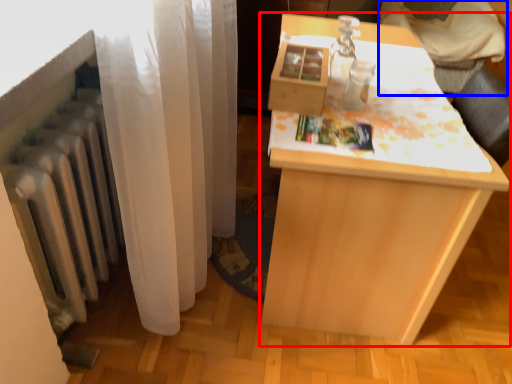
Question: Which point is further to the camera, table (highlighted by a red box) or furniture (highlighted by a blue box)?

Choices:
 (A) table
 (B) furniture

Answer: (B)